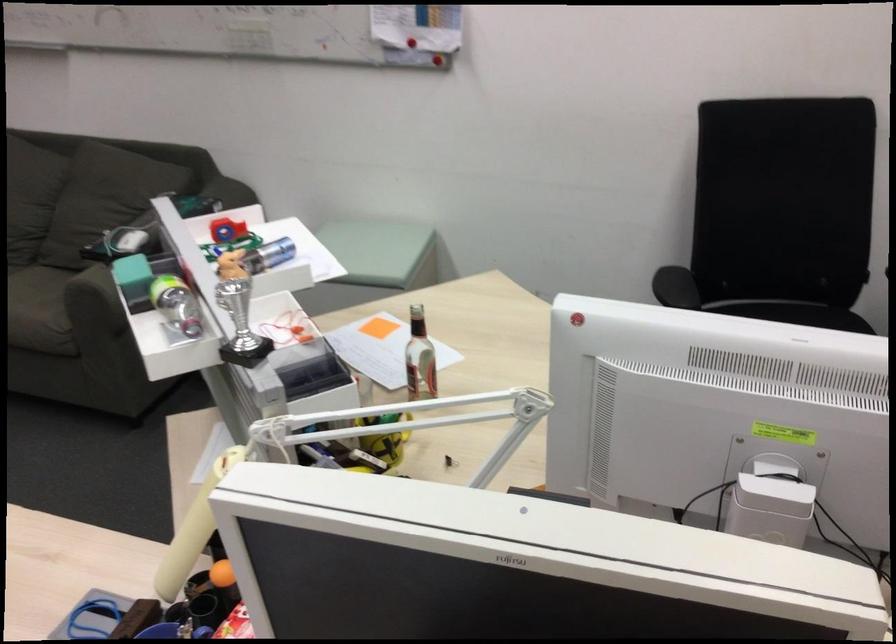
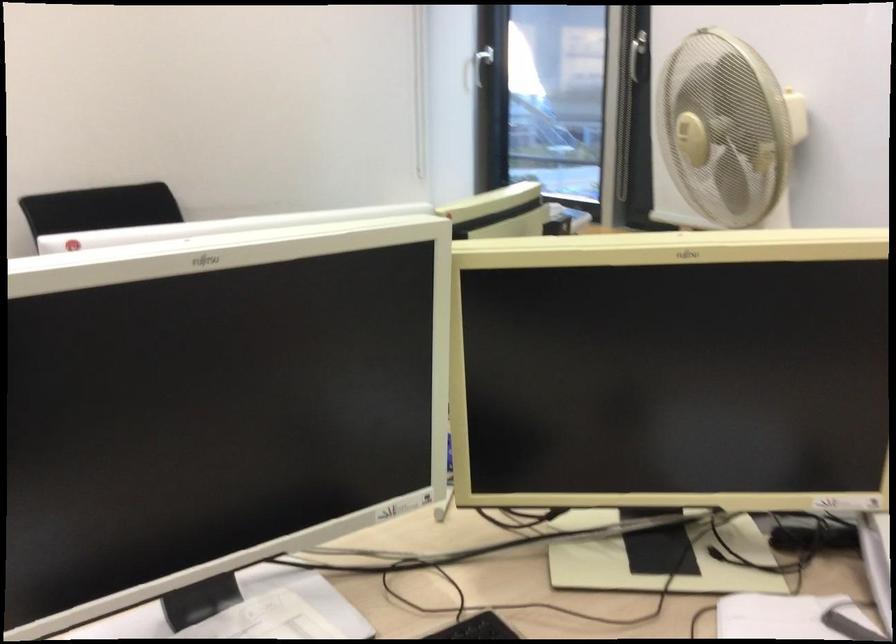
Question: I am providing you with two images of the same scene from different viewpoints. After the viewpoint changes to image2, which objects are now occluded?

Choices:
 (A) black telephone
 (B) scanner lid
 (C) black chair armrest
 (D) fan control knob

Answer: (C)